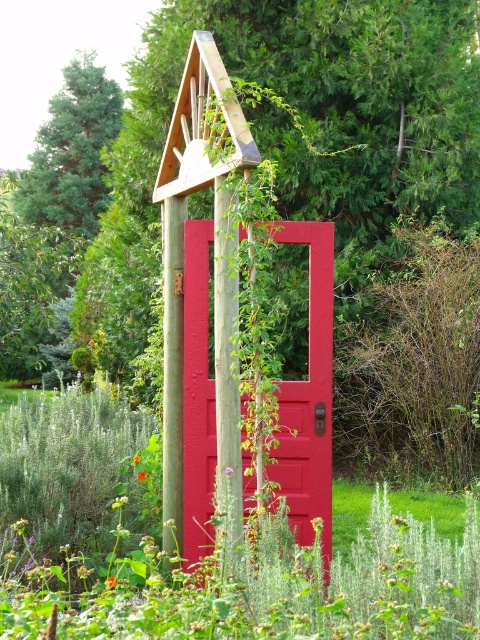
Question: Can you confirm if matte wooden door at center is smaller than wooden post at center?

Choices:
 (A) no
 (B) yes

Answer: (A)

Question: Among these objects, which one is farthest from the camera?

Choices:
 (A) wooden post at center
 (B) matte wooden door at center

Answer: (A)

Question: Can you confirm if matte wooden door at center is positioned above wooden post at center?

Choices:
 (A) no
 (B) yes

Answer: (A)

Question: Which point is farther to the camera?

Choices:
 (A) matte wooden door at center
 (B) wooden post at center

Answer: (B)

Question: Which object is closer to the camera taking this photo?

Choices:
 (A) wooden post at center
 (B) matte wooden door at center

Answer: (B)

Question: Is matte wooden door at center positioned before wooden post at center?

Choices:
 (A) no
 (B) yes

Answer: (B)